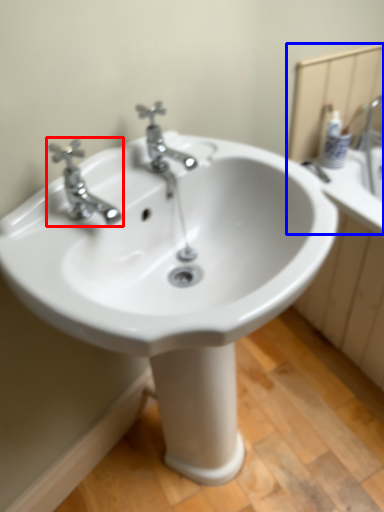
Question: Among these objects, which one is nearest to the camera, tap (highlighted by a red box) or mirror (highlighted by a blue box)?

Choices:
 (A) tap
 (B) mirror

Answer: (A)